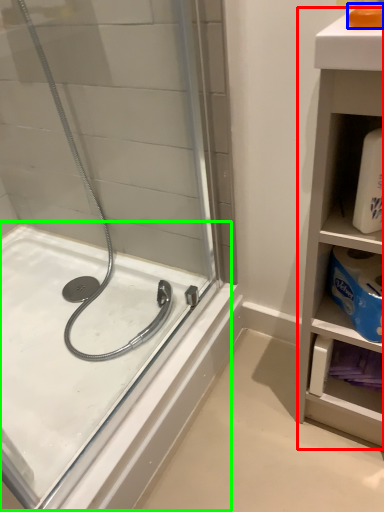
Question: Which is farther away from bathroom cabinet (highlighted by a red box)? soap (highlighted by a blue box) or bath (highlighted by a green box)?

Choices:
 (A) soap
 (B) bath

Answer: (B)